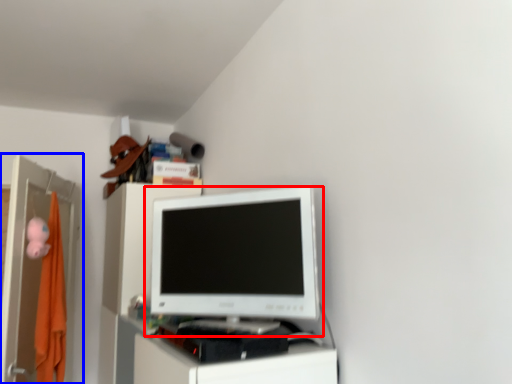
Question: Which point is further to the camera, computer monitor (highlighted by a red box) or file cabinet (highlighted by a blue box)?

Choices:
 (A) computer monitor
 (B) file cabinet

Answer: (B)